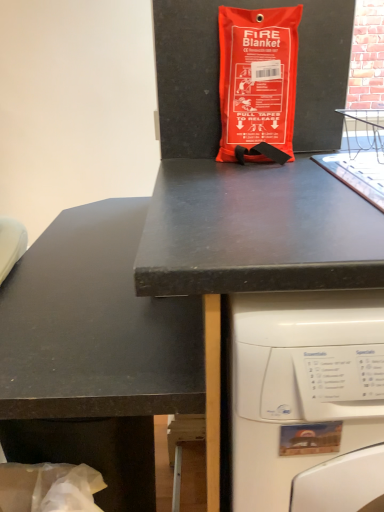
Locate an element on the screen. This screenshot has width=384, height=512. vacant area that is in front of orange fabric fire blanket at center is located at coordinates (260, 170).